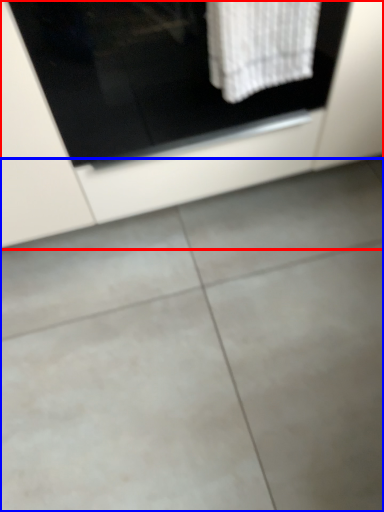
Question: Which object is further to the camera taking this photo, cabinetry (highlighted by a red box) or concrete (highlighted by a blue box)?

Choices:
 (A) cabinetry
 (B) concrete

Answer: (B)